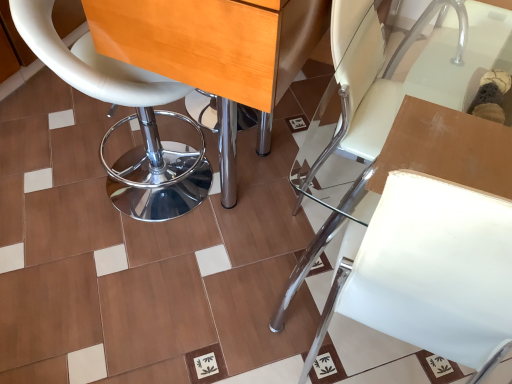
At what (x,y) coordinates should I click in order to perform the action: click on free space that is to the left of white leather stool at left, placed as the first chair when sorted from left to right. Please return your answer as a coordinate pair (x, y). Image resolution: width=512 pixels, height=384 pixels. Looking at the image, I should click on (51, 173).